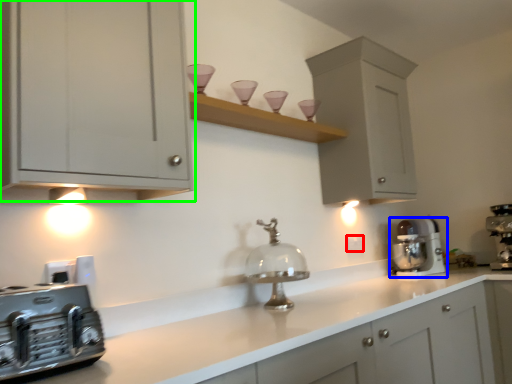
Question: Which object is positioned closest to electric outlet (highlighted by a red box)? Select from home appliance (highlighted by a blue box) and cabinetry (highlighted by a green box).

Choices:
 (A) home appliance
 (B) cabinetry

Answer: (A)